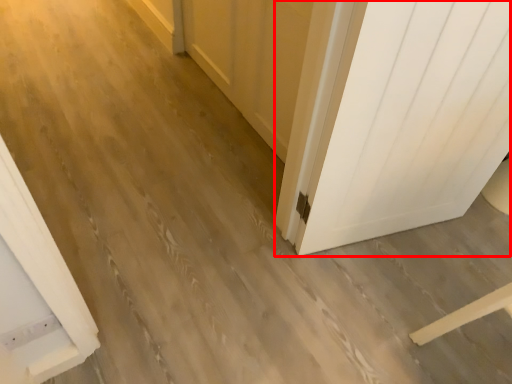
Question: From the image's perspective, considering the relative positions of door (annotated by the red box) and barn door in the image provided, where is door (annotated by the red box) located with respect to the staircase?

Choices:
 (A) above
 (B) below

Answer: (B)